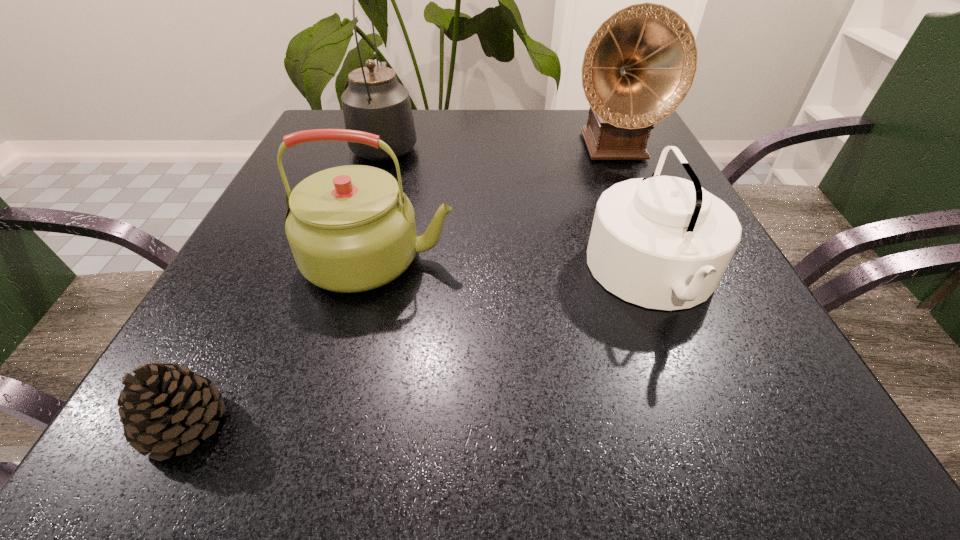
At what (x,y) coordinates should I click in order to perform the action: click on the farthest kettle. Please return your answer as a coordinate pair (x, y). The height and width of the screenshot is (540, 960). Looking at the image, I should click on (375, 102).

Where is `phonograph record`? phonograph record is located at coordinates (640, 64).

You are a GUI agent. You are given a task and a screenshot of the screen. Output one action in this format:
    pyautogui.click(x=<x>, y=<y>)
    Task: Click on the third shortest object
    The width and height of the screenshot is (960, 540).
    Given the screenshot: What is the action you would take?
    pyautogui.click(x=351, y=228)

Where is `the shortest kettle`? The height and width of the screenshot is (540, 960). the shortest kettle is located at coordinates (663, 242).

Where is `the rightmost kettle`? This screenshot has width=960, height=540. the rightmost kettle is located at coordinates (663, 242).

The width and height of the screenshot is (960, 540). I want to click on the nearest object, so click(164, 406).

Image resolution: width=960 pixels, height=540 pixels. Identify the location of the leftmost object. (164, 406).

Identify the location of free space located 0.050m spout on the farthest kettle. This screenshot has height=540, width=960. (396, 115).

Image resolution: width=960 pixels, height=540 pixels. I want to click on vacant space located 0.350m on the horn of the phonograph record, so click(x=672, y=280).

I want to click on free space located at the spout of the second tallest kettle, so [x=660, y=258].